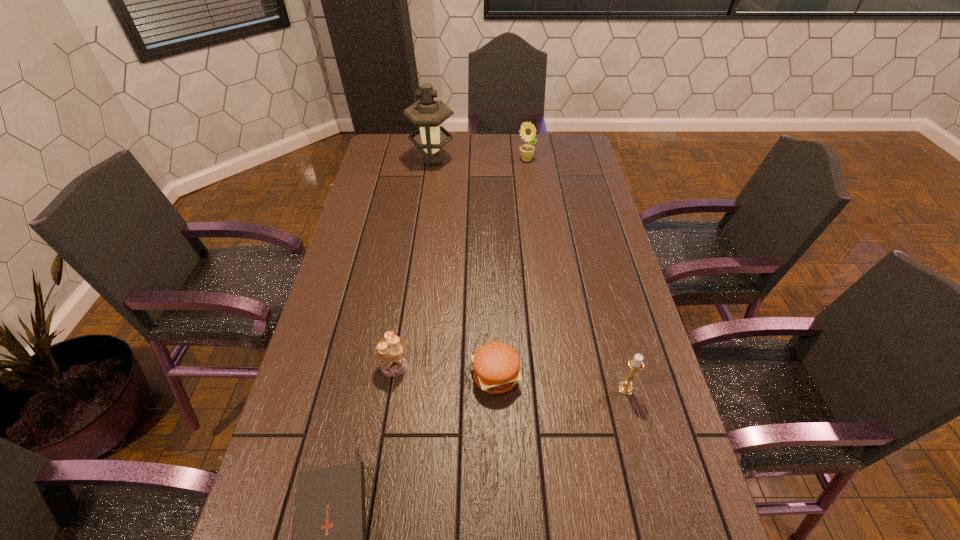
Locate an element on the screen. The height and width of the screenshot is (540, 960). vacant space located 0.180m on the back of the rightmost object is located at coordinates (609, 325).

You are a GUI agent. You are given a task and a screenshot of the screen. Output one action in this format:
    pyautogui.click(x=<x>, y=<y>)
    Task: Click on the vacant space located 0.280m on the left of the hamburger
    
    Given the screenshot: What is the action you would take?
    pyautogui.click(x=360, y=376)

At what (x,y) coordinates should I click in order to perform the action: click on oil lamp that is at the far edge. Please return your answer as a coordinate pair (x, y). The image size is (960, 540). Looking at the image, I should click on (428, 114).

Where is `sunflower located at the far edge`? Image resolution: width=960 pixels, height=540 pixels. sunflower located at the far edge is located at coordinates (527, 130).

Locate an element on the screen. This screenshot has width=960, height=540. object at the left edge is located at coordinates (428, 114).

The height and width of the screenshot is (540, 960). I want to click on object located at the right edge, so click(x=625, y=387).

The image size is (960, 540). I want to click on object that is at the far left corner, so click(428, 114).

Image resolution: width=960 pixels, height=540 pixels. What are the coordinates of `vacant space at the far edge of the desktop` in the screenshot? It's located at (454, 151).

The width and height of the screenshot is (960, 540). In the image, there is a desktop. In order to click on vacant space at the left edge in this screenshot , I will do `click(318, 408)`.

Find the location of a particular element. free space at the right edge is located at coordinates (568, 178).